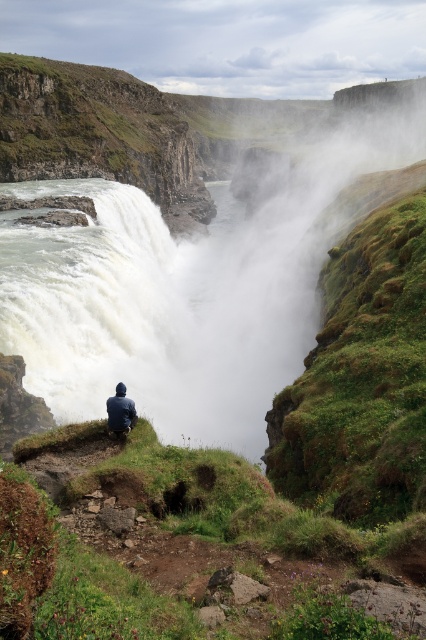
Can you confirm if white mist at center is positioned above dark blue jacket at center?

Yes.

Locate an element on the screen. white mist at center is located at coordinates (199, 269).